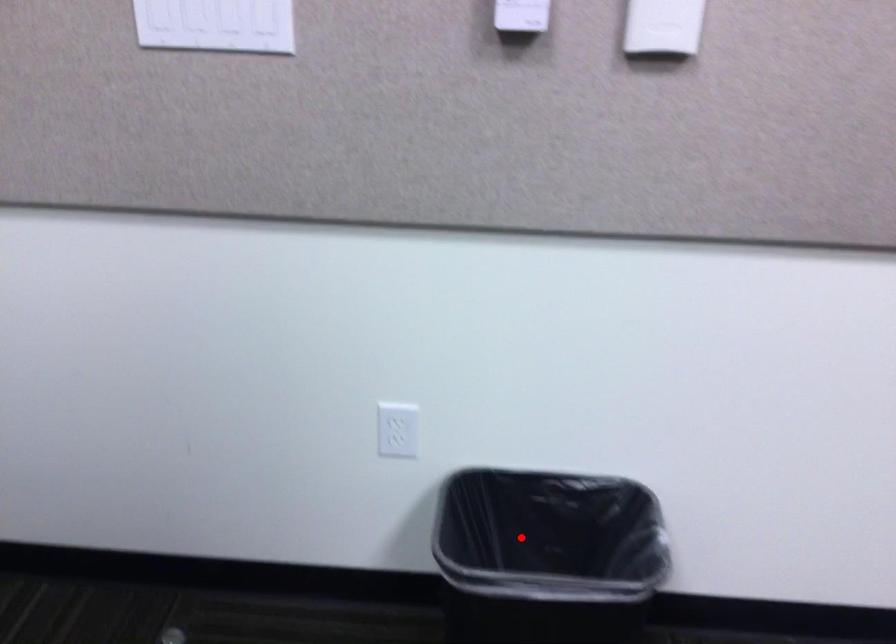
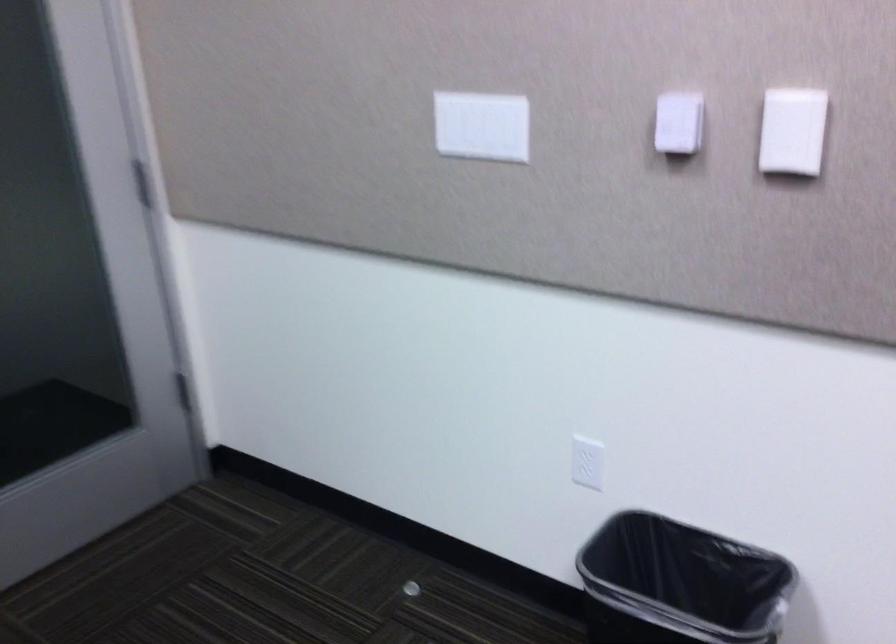
Where in the second image is the point corresponding to the highlighted location from the first image?

(679, 583)